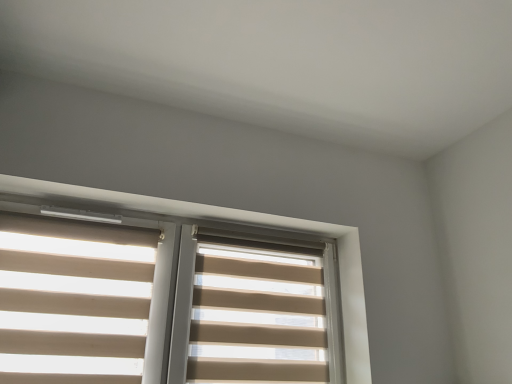
Question: Is beige fabric blind at center, the 1th blind positioned from the right, at the left side of beige fabric blinds at left, acting as the second blind starting from the right?

Choices:
 (A) no
 (B) yes

Answer: (A)

Question: From the image's perspective, is beige fabric blind at center, which is counted as the second blind, starting from the left, over beige fabric blinds at left, which is the 1th blind from left to right?

Choices:
 (A) no
 (B) yes

Answer: (A)

Question: Is the surface of beige fabric blind at center, which is counted as the second blind, starting from the left, in direct contact with beige fabric blinds at left, which is the 1th blind from left to right?

Choices:
 (A) yes
 (B) no

Answer: (B)

Question: Does beige fabric blind at center, which is counted as the second blind, starting from the left, have a larger size compared to beige fabric blinds at left, acting as the second blind starting from the right?

Choices:
 (A) no
 (B) yes

Answer: (B)

Question: Considering the relative positions of beige fabric blind at center, the 1th blind positioned from the right, and beige fabric blinds at left, which is the 1th blind from left to right, in the image provided, is beige fabric blind at center, the 1th blind positioned from the right, to the right of beige fabric blinds at left, which is the 1th blind from left to right, from the viewer's perspective?

Choices:
 (A) yes
 (B) no

Answer: (A)

Question: Would you say beige fabric blinds at upper center is inside or outside beige fabric blind at center, the 1th blind positioned from the right?

Choices:
 (A) outside
 (B) inside

Answer: (A)

Question: Is beige fabric blinds at upper center wider or thinner than beige fabric blind at center, the 1th blind positioned from the right?

Choices:
 (A) wide
 (B) thin

Answer: (A)

Question: Based on their positions, is beige fabric blinds at upper center located to the left or right of beige fabric blind at center, the 1th blind positioned from the right?

Choices:
 (A) left
 (B) right

Answer: (A)

Question: Based on their sizes in the image, would you say beige fabric blinds at upper center is bigger or smaller than beige fabric blind at center, which is counted as the second blind, starting from the left?

Choices:
 (A) big
 (B) small

Answer: (A)

Question: Is beige fabric blinds at left, which is the 1th blind from left to right, situated inside beige fabric blind at center, the 1th blind positioned from the right, or outside?

Choices:
 (A) outside
 (B) inside

Answer: (A)

Question: Looking at their shapes, would you say beige fabric blinds at left, acting as the second blind starting from the right, is wider or thinner than beige fabric blind at center, the 1th blind positioned from the right?

Choices:
 (A) wide
 (B) thin

Answer: (A)

Question: From a real-world perspective, is beige fabric blinds at left, which is the 1th blind from left to right, physically located above or below beige fabric blind at center, which is counted as the second blind, starting from the left?

Choices:
 (A) below
 (B) above

Answer: (A)

Question: Considering the positions of point (10, 251) and point (193, 339), is point (10, 251) closer or farther from the camera than point (193, 339)?

Choices:
 (A) closer
 (B) farther

Answer: (A)

Question: In terms of size, does beige fabric blind at center, the 1th blind positioned from the right, appear bigger or smaller than beige fabric blinds at upper center?

Choices:
 (A) small
 (B) big

Answer: (A)

Question: Relative to beige fabric blinds at upper center, is beige fabric blind at center, the 1th blind positioned from the right, in front or behind?

Choices:
 (A) front
 (B) behind

Answer: (B)